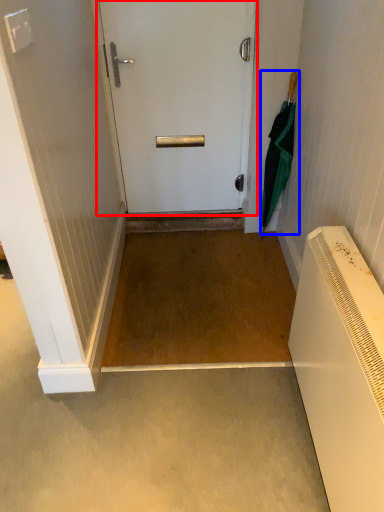
Question: Which object appears closest to the camera in this image, door (highlighted by a red box) or umbrella (highlighted by a blue box)?

Choices:
 (A) door
 (B) umbrella

Answer: (B)